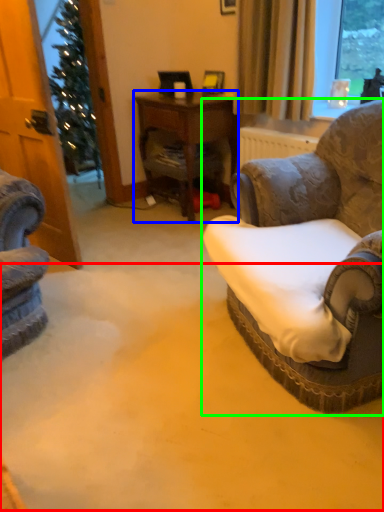
Question: Which object is the farthest from plain (highlighted by a red box)? Choose among these: desk (highlighted by a blue box) or chair (highlighted by a green box).

Choices:
 (A) desk
 (B) chair

Answer: (A)